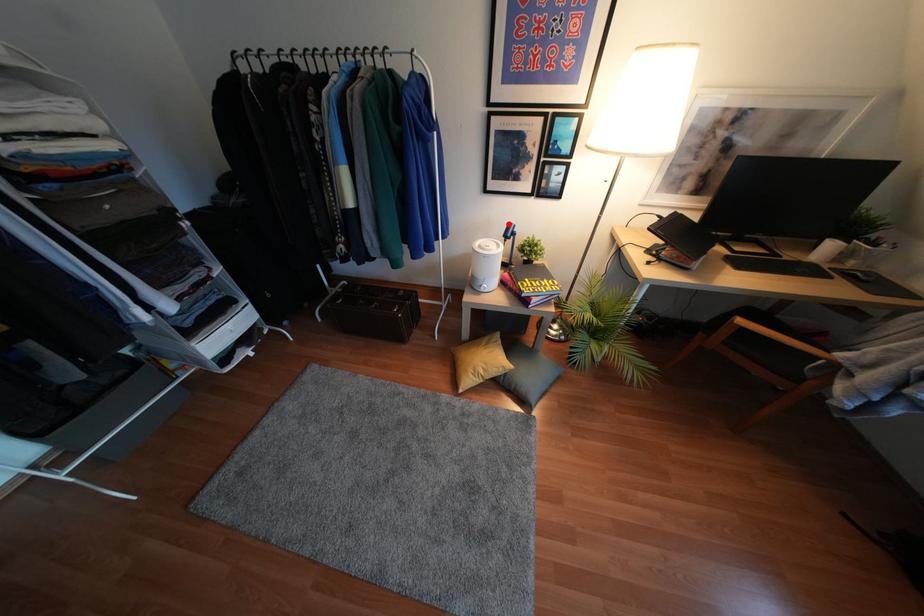
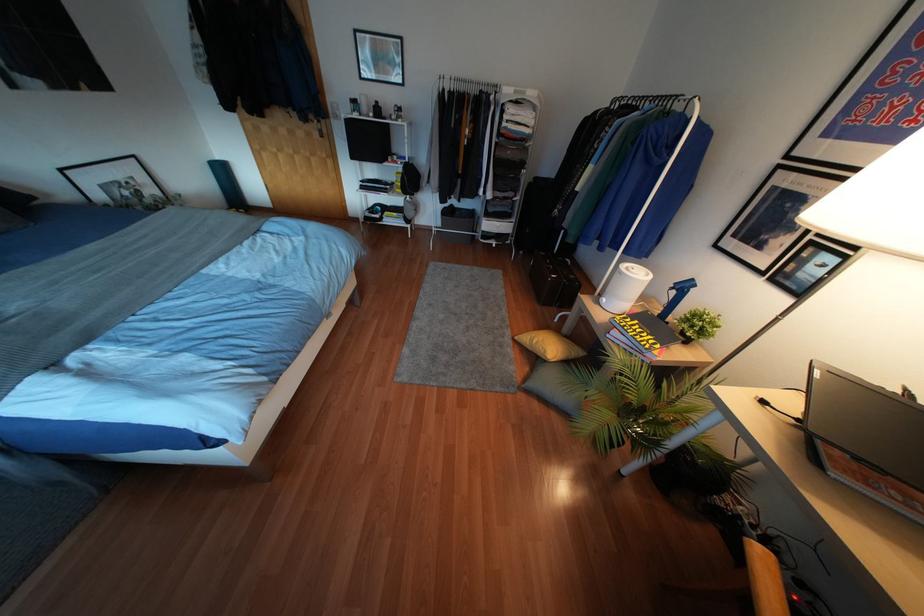
The point at the highlighted location is marked in the first image. Where is the corresponding point in the second image?

(690, 280)